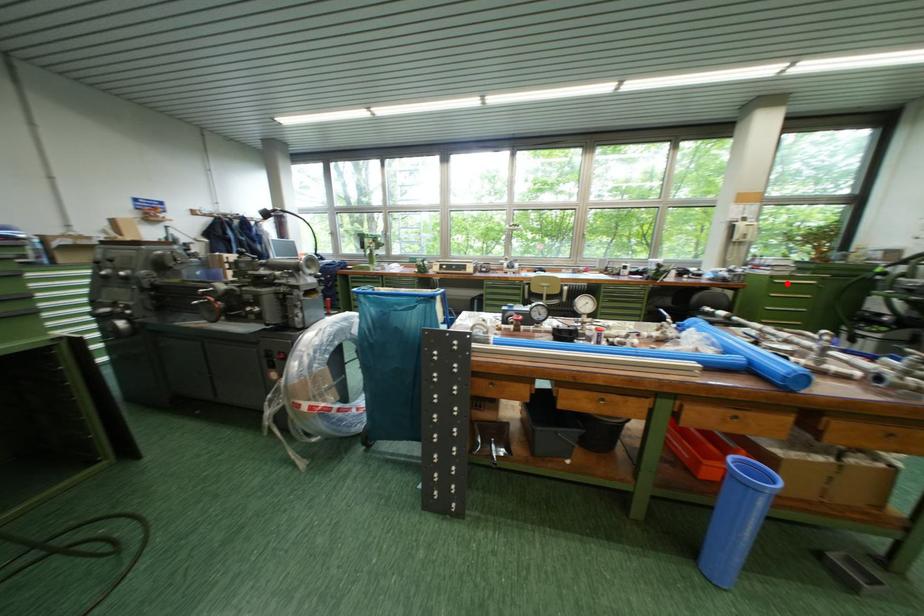
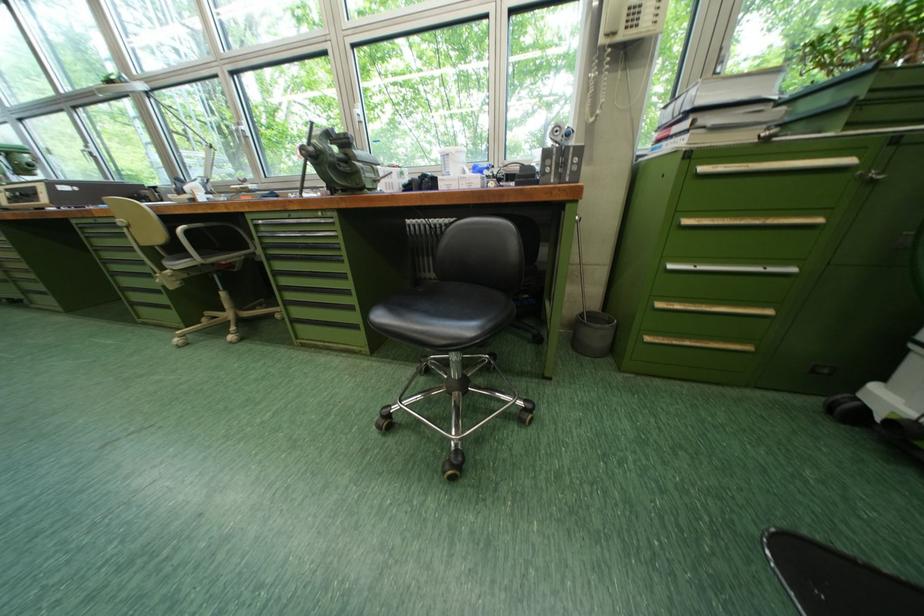
Find the pixel in the second image that matches the highlighted location in the first image.

(713, 169)